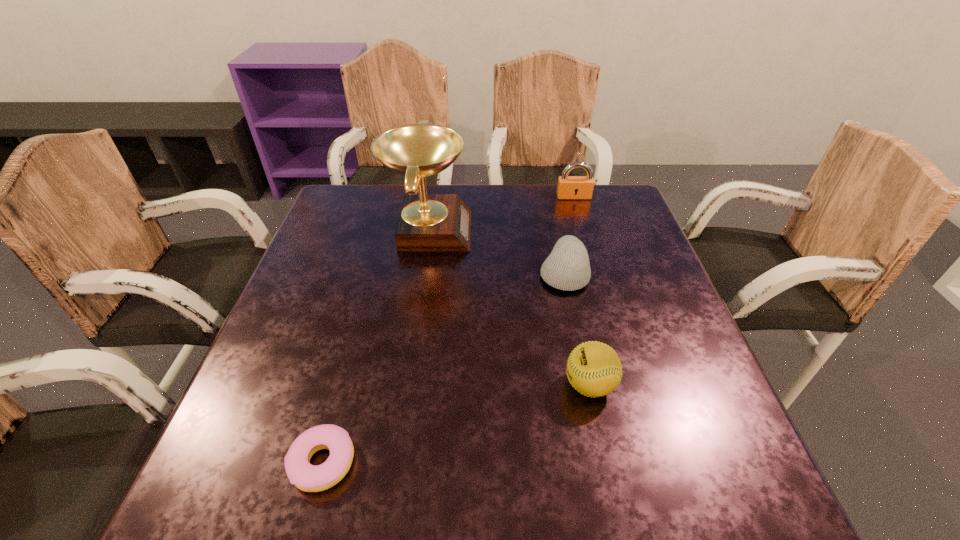
Find the location of a particular element. The image size is (960, 540). free location at the far edge of the desktop is located at coordinates (558, 214).

Image resolution: width=960 pixels, height=540 pixels. In order to click on free space at the near edge in this screenshot , I will do `click(474, 474)`.

In the image, there is a desktop. Identify the location of vacant space at the left edge. pos(365,240).

Where is `vacant space at the right edge`? vacant space at the right edge is located at coordinates (666, 290).

The width and height of the screenshot is (960, 540). In the image, there is a desktop. Identify the location of vacant space at the far left corner. (368, 188).

The height and width of the screenshot is (540, 960). In the image, there is a desktop. What are the coordinates of `vacant space at the near left corner` in the screenshot? It's located at (227, 489).

Identify the location of free region at the far right corner of the desktop. The width and height of the screenshot is (960, 540). (595, 186).

The width and height of the screenshot is (960, 540). What are the coordinates of `unoccupied area between the softball and the shortest object` in the screenshot? It's located at (456, 423).

You are a GUI agent. You are given a task and a screenshot of the screen. Output one action in this format:
    pyautogui.click(x=<x>, y=<y>)
    Task: Click on the free space between the nearest object and the award
    Image resolution: width=960 pixels, height=540 pixels.
    Given the screenshot: What is the action you would take?
    pyautogui.click(x=375, y=346)

The image size is (960, 540). I want to click on free space between the padlock and the award, so click(501, 213).